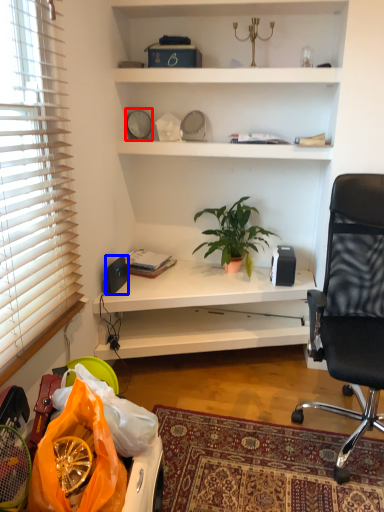
Question: Which object appears farthest to the camera in this image, clock (highlighted by a red box) or loudspeaker (highlighted by a blue box)?

Choices:
 (A) clock
 (B) loudspeaker

Answer: (A)